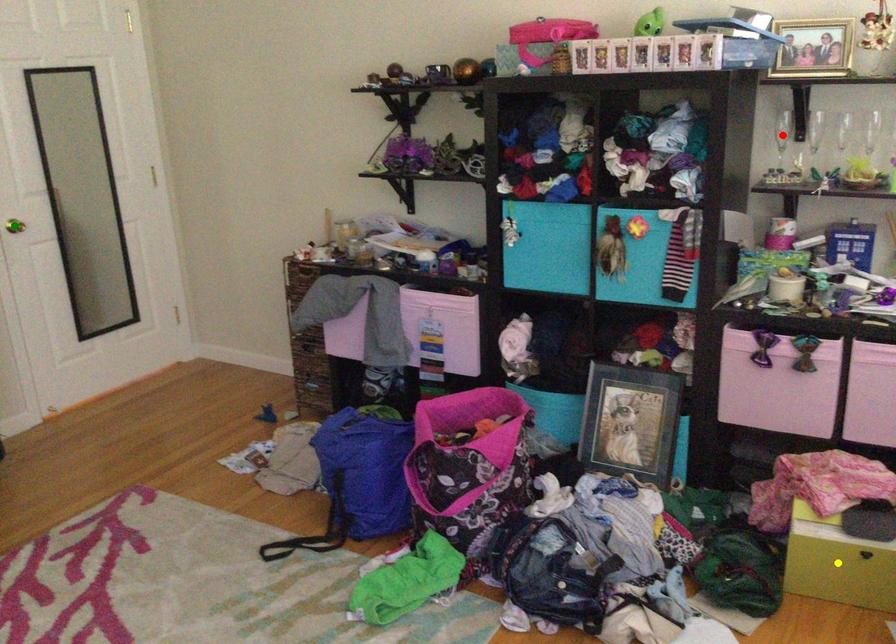
Order these from nearest to farthest:
A) yellow point
B) red point
C) green point

yellow point → red point → green point